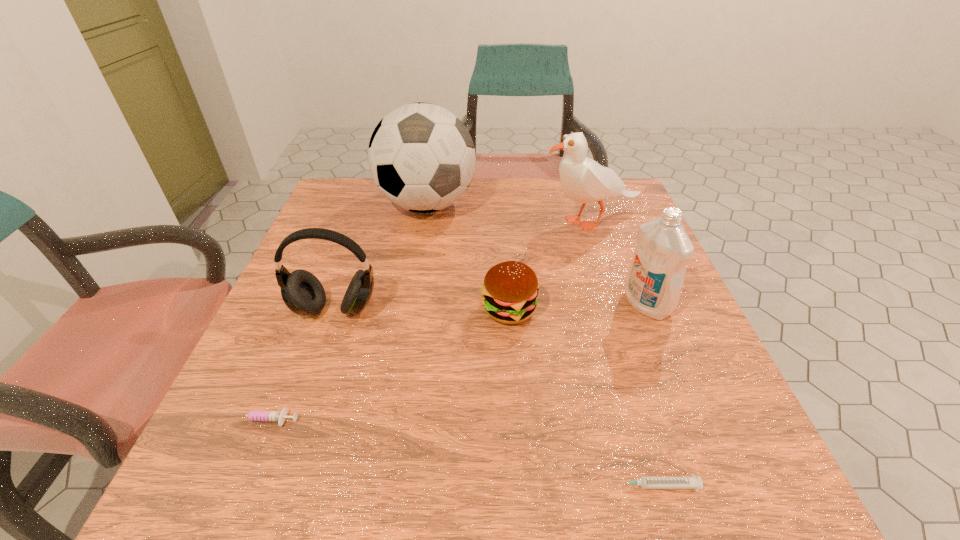
I want to click on free region that satisfies the following two spatial constraints: 1. at the beak of the gull; 2. on the ear cups of the headset, so click(620, 309).